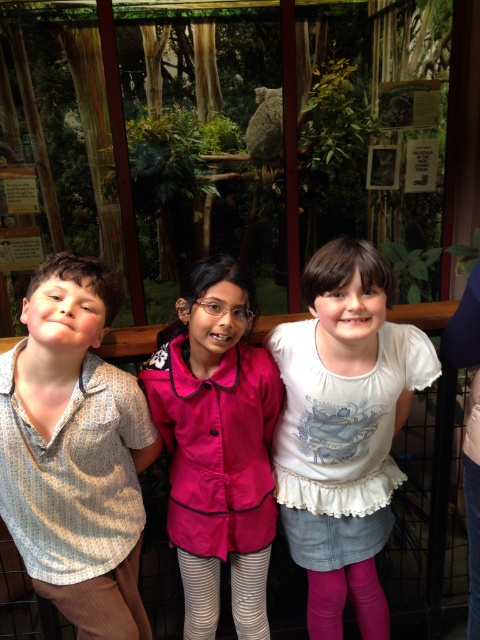
You are a photographer trying to capture a group photo of the children in front of the zoo enclosure. You need to arrange them so that the light brown textured shirt at left and the pink fabric shirt at center are in the correct order from left to right. Which shirt should be on the left side?

The light brown textured shirt at left should be on the left side because it is positioned on the left side of the pink fabric shirt at center.

You are a photographer taking a picture of the scene. You need to focus on the light brown textured shirt at left. Where should you aim your camera to capture it accurately?

You should aim your camera at the coordinates point (74, 451) to capture the light brown textured shirt at left accurately.

Please answer based on the coordinates provided. The white cotton shirt at center is represented by point [344,429]. If the glass enclosure is at coordinate 0.0, 0.0, which direction is the white cotton shirt at center relative to the glass enclosure?

The white cotton shirt at center is located at coordinate [344,429], which is to the upper right direction relative to the glass enclosure at 0.0, 0.0.